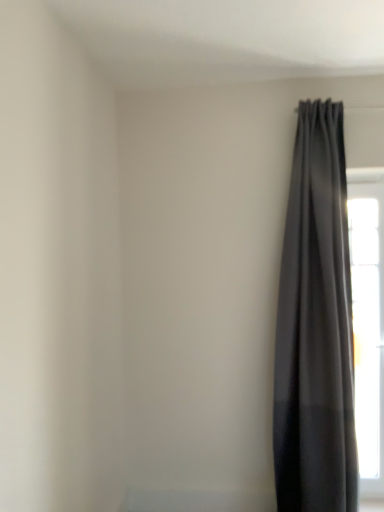
Image resolution: width=384 pixels, height=512 pixels. Describe the element at coordinates (315, 327) in the screenshot. I see `dark gray sheer curtain at right` at that location.

The image size is (384, 512). Identify the location of dark gray sheer curtain at right. (315, 327).

Measure the distance between dark gray sheer curtain at right and camera.

dark gray sheer curtain at right and camera are 2.28 meters apart from each other.

Identify the location of dark gray sheer curtain at right. (315, 327).